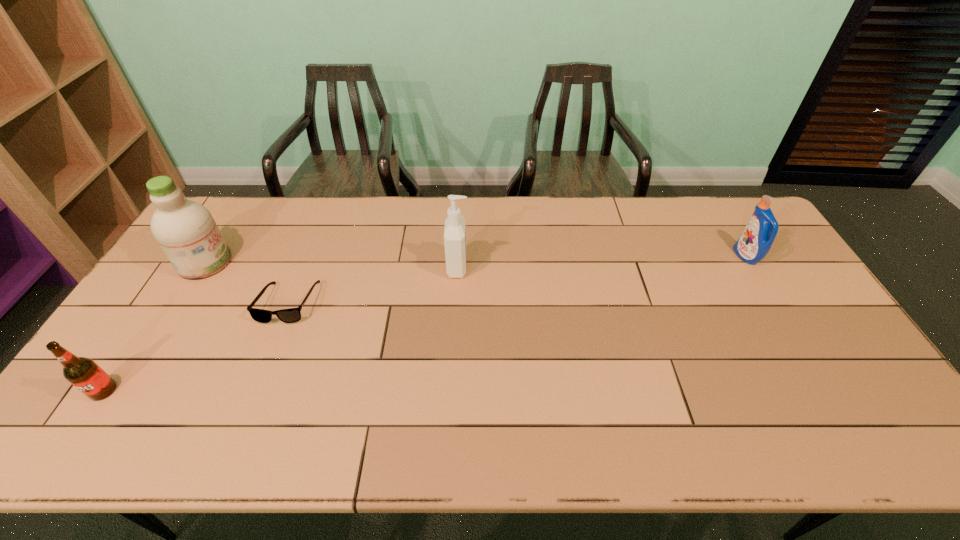
Image resolution: width=960 pixels, height=540 pixels. What are the coordinates of `free spot between the second object from right to left and the rightmost object` in the screenshot? It's located at (602, 261).

The height and width of the screenshot is (540, 960). I want to click on unoccupied area between the root beer and the left cleansing agent, so click(x=155, y=327).

This screenshot has width=960, height=540. Identify the location of free space between the root beer and the rightmost object. (424, 323).

Locate an element on the screen. free spot between the shortest object and the fourth object from left to right is located at coordinates pos(373,285).

Where is `free space between the left cleansing agent and the sunglasses`? free space between the left cleansing agent and the sunglasses is located at coordinates (247, 283).

Identify the location of free space between the left cleansing agent and the root beer. Image resolution: width=960 pixels, height=540 pixels. (155, 327).

This screenshot has width=960, height=540. In order to click on empty space between the fourth object from left to right and the left cleansing agent in this screenshot , I will do `click(331, 265)`.

Locate an element on the screen. vacant area that lies between the second object from right to left and the rightmost object is located at coordinates (602, 261).

Identify the location of blank region between the rightmost object and the second object from right to left. (602, 261).

At what (x,y) coordinates should I click in order to perform the action: click on object that is the fourth closest to the detergent. Please return your answer as a coordinate pair (x, y). Looking at the image, I should click on (82, 372).